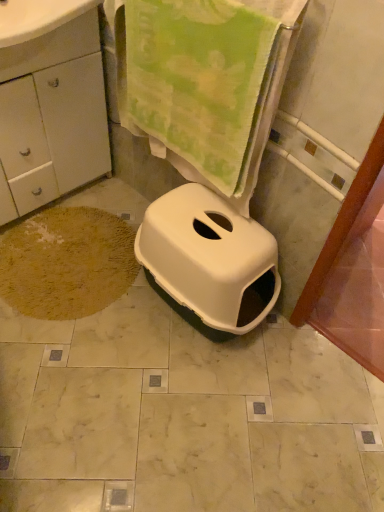
Question: Can we say white matte cabinet at lower left lies outside green plush towel at upper center?

Choices:
 (A) no
 (B) yes

Answer: (B)

Question: Does white matte cabinet at lower left appear on the left side of green plush towel at upper center?

Choices:
 (A) no
 (B) yes

Answer: (B)

Question: From the image's perspective, is white matte cabinet at lower left located beneath green plush towel at upper center?

Choices:
 (A) no
 (B) yes

Answer: (A)

Question: Can you confirm if white matte cabinet at lower left is shorter than green plush towel at upper center?

Choices:
 (A) yes
 (B) no

Answer: (B)

Question: Considering the relative sizes of white matte cabinet at lower left and green plush towel at upper center in the image provided, is white matte cabinet at lower left wider than green plush towel at upper center?

Choices:
 (A) yes
 (B) no

Answer: (A)

Question: Choose the correct answer: Is green plush towel at upper center inside white matte cabinet at lower left or outside it?

Choices:
 (A) outside
 (B) inside

Answer: (A)

Question: Is point (266, 121) closer or farther from the camera than point (67, 169)?

Choices:
 (A) farther
 (B) closer

Answer: (B)

Question: In the image, is green plush towel at upper center on the left side or the right side of white matte cabinet at lower left?

Choices:
 (A) left
 (B) right

Answer: (B)

Question: From a real-world perspective, is green plush towel at upper center above or below white matte cabinet at lower left?

Choices:
 (A) above
 (B) below

Answer: (A)

Question: Is point (291, 15) closer or farther from the camera than point (4, 67)?

Choices:
 (A) closer
 (B) farther

Answer: (A)

Question: Considering the positions of green plush towel at upper center and white glossy drawer at upper left in the image, is green plush towel at upper center taller or shorter than white glossy drawer at upper left?

Choices:
 (A) tall
 (B) short

Answer: (A)

Question: Do you think green plush towel at upper center is within white glossy drawer at upper left, or outside of it?

Choices:
 (A) outside
 (B) inside

Answer: (A)

Question: Considering the relative positions of green plush towel at upper center and white glossy drawer at upper left in the image provided, is green plush towel at upper center to the left or to the right of white glossy drawer at upper left?

Choices:
 (A) right
 (B) left

Answer: (A)

Question: Does point (256, 234) appear closer or farther from the camera than point (79, 308)?

Choices:
 (A) closer
 (B) farther

Answer: (A)

Question: Considering the positions of white plastic litter box at center and brown shaggy rug at lower left in the image, is white plastic litter box at center bigger or smaller than brown shaggy rug at lower left?

Choices:
 (A) small
 (B) big

Answer: (B)